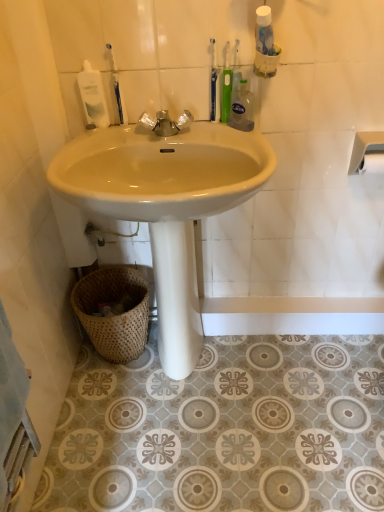
You are a GUI agent. You are given a task and a screenshot of the screen. Output one action in this format:
    pyautogui.click(x=<x>, y=<y>)
    Task: Click on the free spot in front of green plastic toothbrush at upper center, which is the 4th toothbrush from left to right
    This screenshot has width=384, height=512.
    Given the screenshot: What is the action you would take?
    pyautogui.click(x=239, y=139)